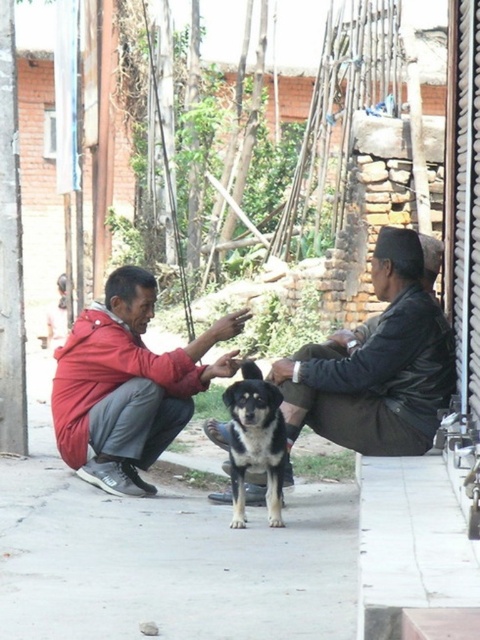
You are a delivery person who needs to place a large package on the gray concrete pavement at center. However, there is a black and brown fur dog at center in the way. Can you place the package on the pavement without moving the dog?

The gray concrete pavement at center has a larger size compared to the black and brown fur dog at center, so yes, you can place the package on the gray concrete pavement at center without moving the dog since there is enough space available.

You are a photographer trying to capture a candid shot of the two people and the dog. You notice the leather jacket at center and the red matte jacket at center. Which jacket should you focus on if you want to photograph the person closer to the ground?

The red matte jacket at center is closer to the ground, so focusing on it would capture the person squatting down.

You are a photographer trying to capture a candid shot of the scene. You want to ensure that both the leather jacket at center and the red matte jacket at center are clearly visible in the frame. Based on their positions, which jacket should you focus on first to ensure it doesn t get obscured?

The leather jacket at center is in front of the red matte jacket at center, so you should focus on the red matte jacket at center first to ensure it doesn t get obscured by the leather jacket.